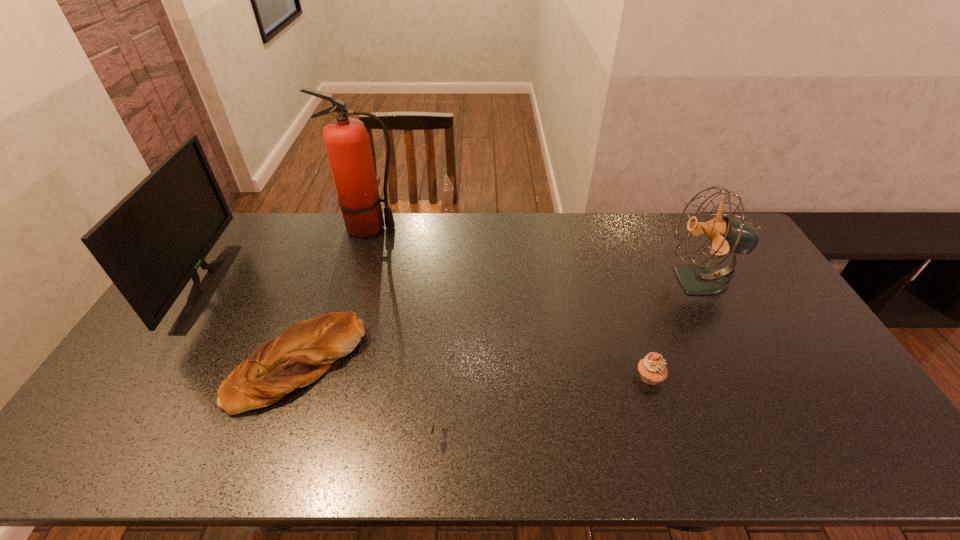
Where is `blank area in the image that satisfies the following two spatial constraints: 1. on the back side of the second object from right to left; 2. on the front-facing side of the monitor`? This screenshot has width=960, height=540. blank area in the image that satisfies the following two spatial constraints: 1. on the back side of the second object from right to left; 2. on the front-facing side of the monitor is located at coordinates (619, 286).

I want to click on vacant area that satisfies the following two spatial constraints: 1. on the back side of the bread; 2. on the front-facing side of the monitor, so click(327, 286).